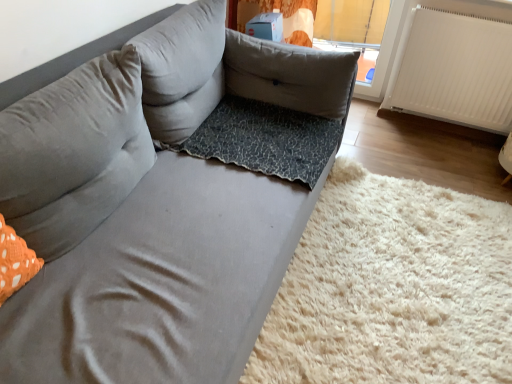
Question: Should I look upward or downward to see white ribbed radiator at right?

Choices:
 (A) up
 (B) down

Answer: (A)

Question: Considering the relative sizes of white ribbed radiator at right and gray fabric pillow at upper left, which is counted as the third pillow, starting from the right, in the image provided, is white ribbed radiator at right shorter than gray fabric pillow at upper left, which is counted as the third pillow, starting from the right,?

Choices:
 (A) yes
 (B) no

Answer: (B)

Question: From the image's perspective, does white ribbed radiator at right appear lower than gray fabric pillow at upper left, which is counted as the 1th pillow, starting from the left?

Choices:
 (A) yes
 (B) no

Answer: (B)

Question: From a real-world perspective, does white ribbed radiator at right stand above gray fabric pillow at upper left, which is counted as the third pillow, starting from the right?

Choices:
 (A) yes
 (B) no

Answer: (B)

Question: Could you tell me if white ribbed radiator at right is turned towards gray fabric pillow at upper left, which is counted as the third pillow, starting from the right?

Choices:
 (A) yes
 (B) no

Answer: (A)

Question: Does white ribbed radiator at right have a larger size compared to gray fabric pillow at upper left, which is counted as the 1th pillow, starting from the left?

Choices:
 (A) yes
 (B) no

Answer: (B)

Question: Does white ribbed radiator at right have a smaller size compared to gray fabric pillow at upper left, which is counted as the 1th pillow, starting from the left?

Choices:
 (A) no
 (B) yes

Answer: (B)

Question: Is leopard print fabric dog bed at center at the left side of white ribbed radiator at right?

Choices:
 (A) no
 (B) yes

Answer: (B)

Question: Considering the relative sizes of leopard print fabric dog bed at center and white ribbed radiator at right in the image provided, is leopard print fabric dog bed at center smaller than white ribbed radiator at right?

Choices:
 (A) no
 (B) yes

Answer: (B)

Question: From a real-world perspective, is leopard print fabric dog bed at center over white ribbed radiator at right?

Choices:
 (A) no
 (B) yes

Answer: (A)

Question: From a real-world perspective, does leopard print fabric dog bed at center sit lower than white ribbed radiator at right?

Choices:
 (A) yes
 (B) no

Answer: (A)

Question: Is there a large distance between leopard print fabric dog bed at center and white ribbed radiator at right?

Choices:
 (A) no
 (B) yes

Answer: (B)

Question: Is leopard print fabric dog bed at center completely or partially outside of white ribbed radiator at right?

Choices:
 (A) yes
 (B) no

Answer: (A)

Question: Is gray fabric pillow at center, which ranks as the second pillow in left-to-right order, oriented towards leopard print fabric at lower right?

Choices:
 (A) no
 (B) yes

Answer: (A)